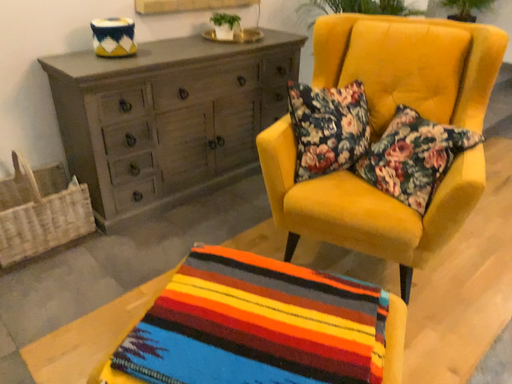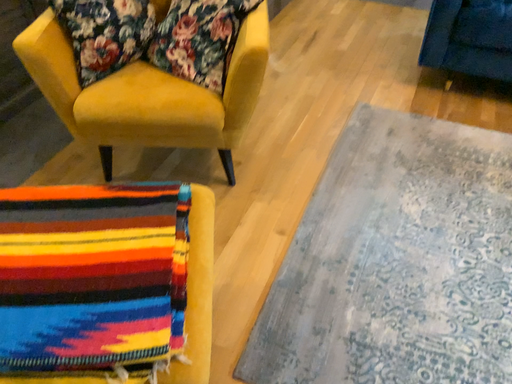
Question: Which way did the camera rotate in the video?

Choices:
 (A) rotated right
 (B) rotated left

Answer: (A)